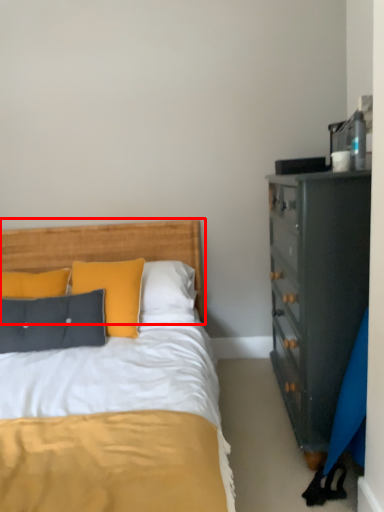
Question: From the image, what is the correct spatial relationship of headboard (annotated by the red box) in relation to pillow?

Choices:
 (A) right
 (B) left

Answer: (A)